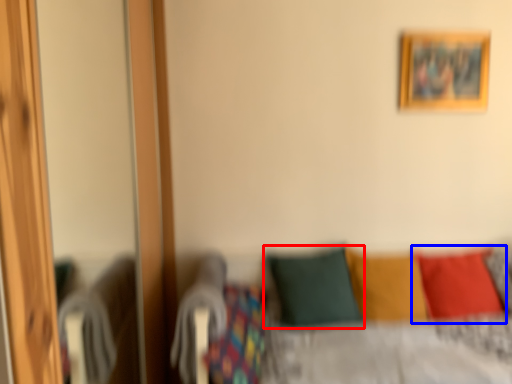
Question: Which object is closer to the camera taking this photo, pillow (highlighted by a red box) or pillow (highlighted by a blue box)?

Choices:
 (A) pillow
 (B) pillow

Answer: (A)